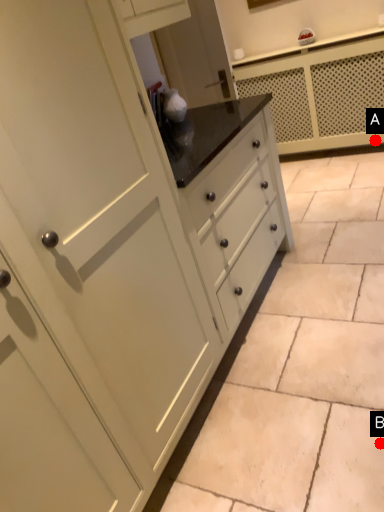
Question: Two points are circled on the image, labeled by A and B beside each circle. Which of the following is the closest to the observer?

Choices:
 (A) A is closer
 (B) B is closer

Answer: (B)